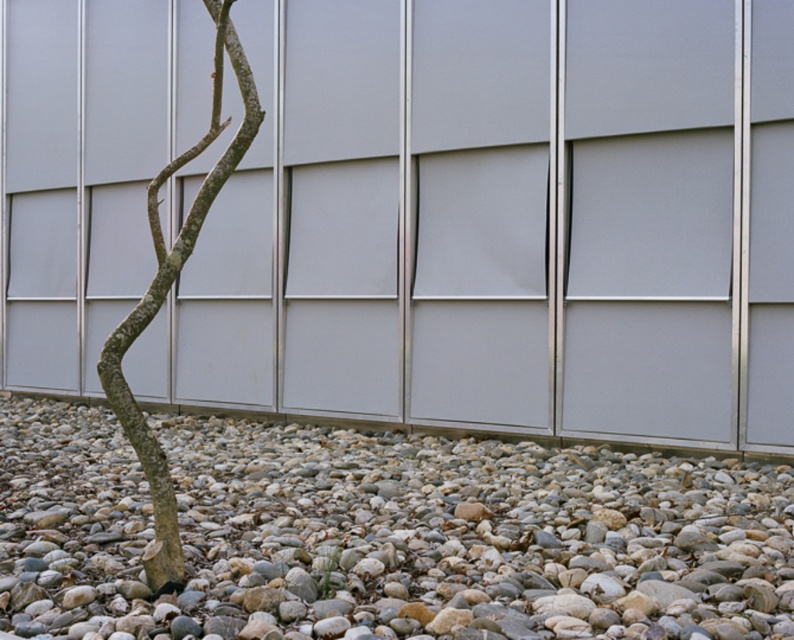
Does smooth pebbles at lower center have a smaller size compared to brown rough bark tree at lower left?

Indeed, smooth pebbles at lower center has a smaller size compared to brown rough bark tree at lower left.

Between point (490, 595) and point (172, 168), which one is positioned in front?

Point (490, 595) is more forward.

The height and width of the screenshot is (640, 794). I want to click on smooth pebbles at lower center, so click(382, 532).